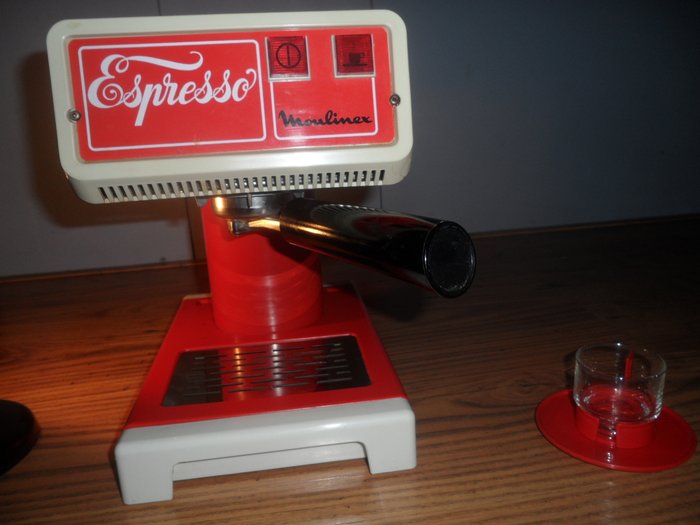
You are a GUI agent. You are given a task and a screenshot of the screen. Output one action in this format:
    pyautogui.click(x=<x>, y=<y>)
    Task: Click on the wood table
    
    Given the screenshot: What is the action you would take?
    pyautogui.click(x=484, y=404)